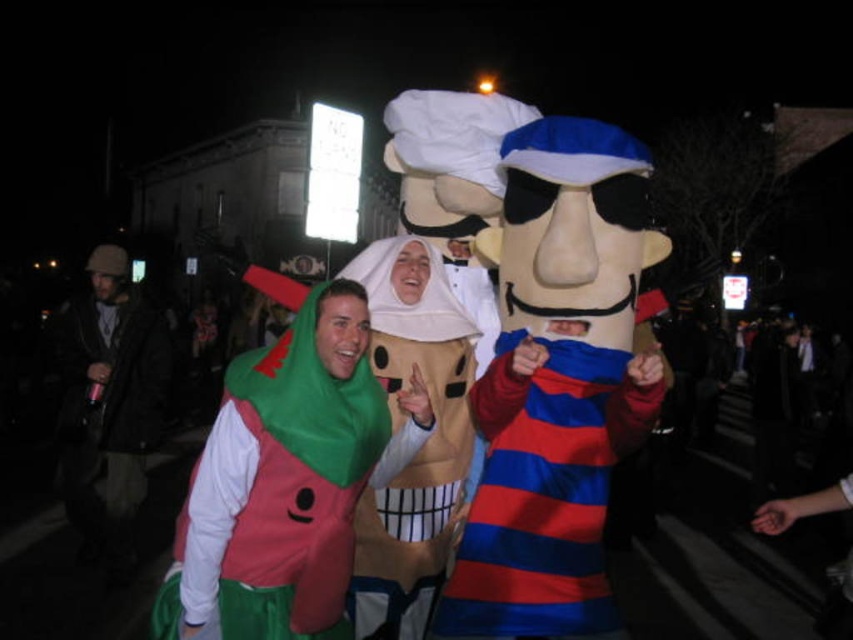
Question: Which is farther from the striped cotton shirt at center?

Choices:
 (A) smooth beige plushie at center
 (B) green fabric costume at center

Answer: (B)

Question: Does smooth beige plushie at center have a greater width compared to dark brown leather jacket at left?

Choices:
 (A) yes
 (B) no

Answer: (B)

Question: Does green fabric costume at center appear on the right side of smooth beige plushie at center?

Choices:
 (A) yes
 (B) no

Answer: (B)

Question: Which of these objects is positioned farthest from the smooth beige plushie at center?

Choices:
 (A) striped cotton shirt at center
 (B) green fabric costume at center

Answer: (A)

Question: Which point appears closest to the camera in this image?

Choices:
 (A) click(605, 435)
 (B) click(126, 336)
 (C) click(372, 525)
 (D) click(277, 388)

Answer: (D)

Question: Is the position of smooth beige plushie at center less distant than that of dark brown leather jacket at left?

Choices:
 (A) yes
 (B) no

Answer: (A)